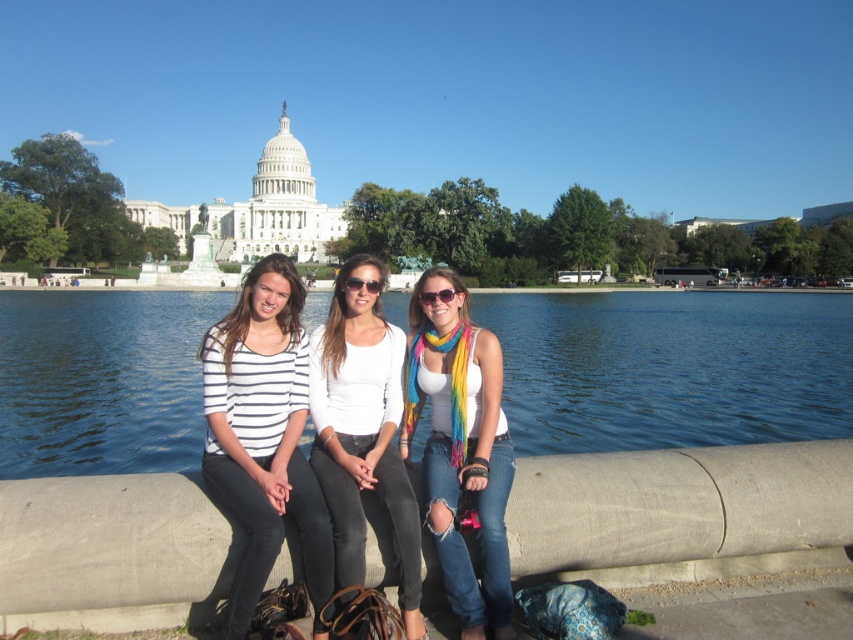
Does blue water at center have a lesser width compared to sunglasses at center?

No.

Does blue water at center appear on the left side of sunglasses at center?

Incorrect, blue water at center is not on the left side of sunglasses at center.

Who is more distant from viewer, (846, 392) or (368, 282)?

The point (846, 392) is behind.

You are a GUI agent. You are given a task and a screenshot of the screen. Output one action in this format:
    pyautogui.click(x=<x>, y=<y>)
    Task: Click on the blue water at center
    The image size is (853, 640).
    Given the screenshot: What is the action you would take?
    pyautogui.click(x=671, y=369)

Which is above, blue water at center or rainbow scarf at center?

blue water at center is higher up.

Which is below, blue water at center or rainbow scarf at center?

rainbow scarf at center is lower down.

This screenshot has width=853, height=640. I want to click on blue water at center, so click(671, 369).

Which is above, blue water at center or white striped shirt at center?

Positioned higher is white striped shirt at center.

This screenshot has width=853, height=640. What do you see at coordinates (671, 369) in the screenshot?
I see `blue water at center` at bounding box center [671, 369].

Where is `blue water at center`? blue water at center is located at coordinates (671, 369).